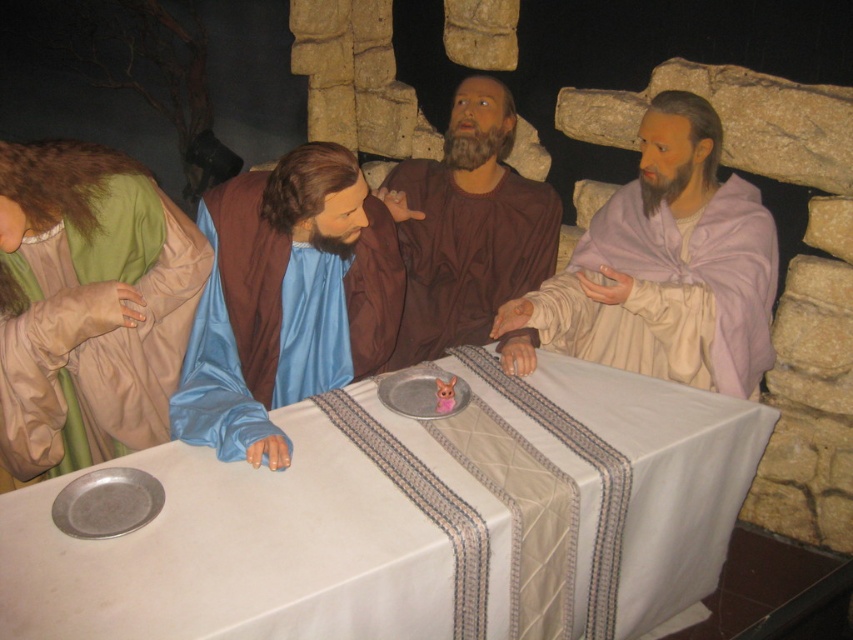
You are an observer in the scene described. There is a brown matte robe at center. Where exactly is the brown matte robe positioned in relation to the table?

The brown matte robe at center is located at point coordinates approximately 0.355 on the horizontal axis and 0.549 on the vertical axis relative to the table.

You are an observer standing in front of the table. You see the blue satin robe at center and the light purple silk robe at right. Which one is closer to the table?

The blue satin robe at center is closer to the table because it is located below the light purple silk robe at right, meaning it is positioned lower and nearer to the table surface.

You are an observer standing at the edge of the table. You see the white cloth at center and the blue satin robe at center. Which object is taller?

The white cloth at center is taller than the blue satin robe at center.